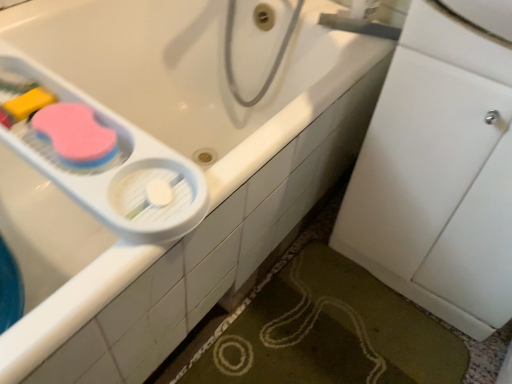
Question: Is green textured bath mat at lower right wider than white plastic faucet at upper right?

Choices:
 (A) yes
 (B) no

Answer: (A)

Question: Can you confirm if green textured bath mat at lower right is smaller than white plastic faucet at upper right?

Choices:
 (A) yes
 (B) no

Answer: (B)

Question: Does green textured bath mat at lower right have a greater height compared to white plastic faucet at upper right?

Choices:
 (A) yes
 (B) no

Answer: (A)

Question: Considering the relative positions of green textured bath mat at lower right and white plastic faucet at upper right in the image provided, is green textured bath mat at lower right to the right of white plastic faucet at upper right from the viewer's perspective?

Choices:
 (A) yes
 (B) no

Answer: (B)

Question: Is green textured bath mat at lower right further to the viewer compared to white plastic faucet at upper right?

Choices:
 (A) yes
 (B) no

Answer: (B)

Question: Are green textured bath mat at lower right and white plastic faucet at upper right located far from each other?

Choices:
 (A) no
 (B) yes

Answer: (A)

Question: From a real-world perspective, is green textured bath mat at lower right located higher than white plastic container at upper left?

Choices:
 (A) yes
 (B) no

Answer: (B)

Question: Considering the relative positions of green textured bath mat at lower right and white plastic container at upper left in the image provided, is green textured bath mat at lower right in front of white plastic container at upper left?

Choices:
 (A) yes
 (B) no

Answer: (B)

Question: Is green textured bath mat at lower right oriented away from white plastic container at upper left?

Choices:
 (A) no
 (B) yes

Answer: (A)

Question: Can you confirm if green textured bath mat at lower right is shorter than white plastic container at upper left?

Choices:
 (A) yes
 (B) no

Answer: (A)

Question: From a real-world perspective, is green textured bath mat at lower right physically below white plastic container at upper left?

Choices:
 (A) yes
 (B) no

Answer: (A)

Question: Considering the relative positions of green textured bath mat at lower right and white plastic container at upper left in the image provided, is green textured bath mat at lower right to the left of white plastic container at upper left from the viewer's perspective?

Choices:
 (A) yes
 (B) no

Answer: (B)

Question: From a real-world perspective, is white plastic container at upper left on top of white plastic faucet at upper right?

Choices:
 (A) yes
 (B) no

Answer: (B)